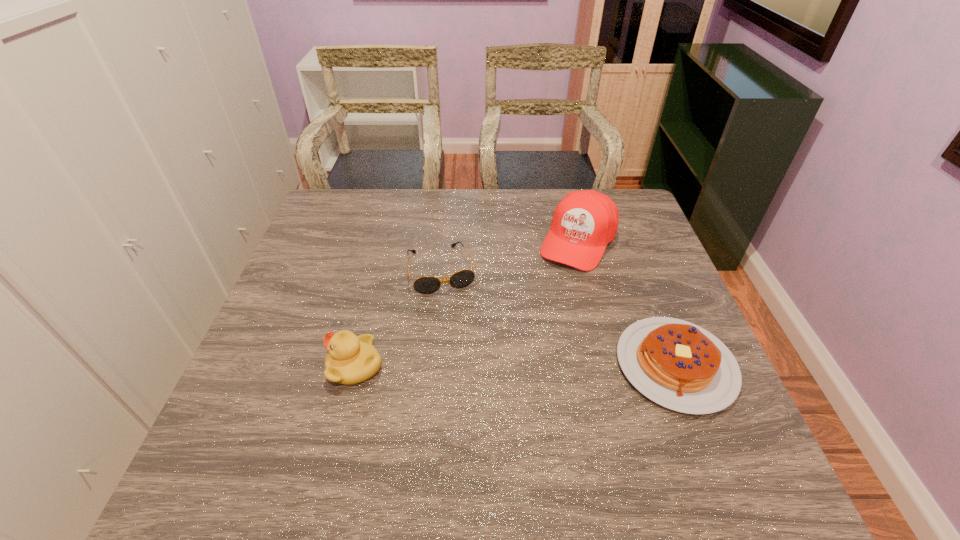
This screenshot has width=960, height=540. Identify the location of free space on the desktop that is between the leftmost object and the pancake and is positioned on the front panel of the tallest object. pos(501,366).

This screenshot has width=960, height=540. I want to click on vacant space on the desktop that is between the third shortest object and the pancake and is positioned on the lenses of the third object from right to left, so click(469, 366).